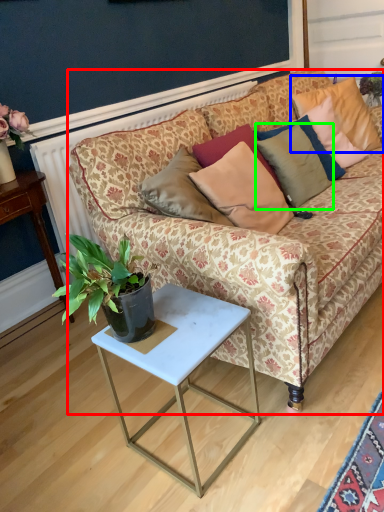
Question: Estimate the real-world distances between objects in this image. Which object is closer to studio couch (highlighted by a red box), pillow (highlighted by a blue box) or pillow (highlighted by a green box)?

Choices:
 (A) pillow
 (B) pillow

Answer: (B)